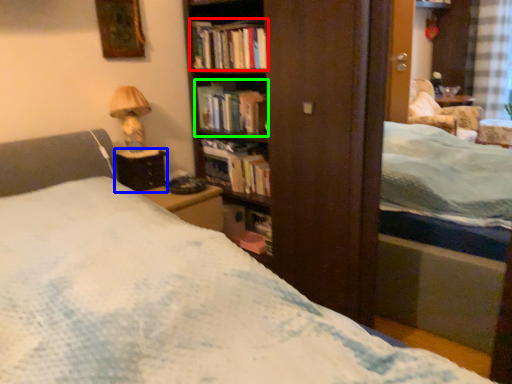
Question: Which is nearer to the book (highlighted by a red box)? table (highlighted by a blue box) or book (highlighted by a green box).

Choices:
 (A) table
 (B) book

Answer: (B)